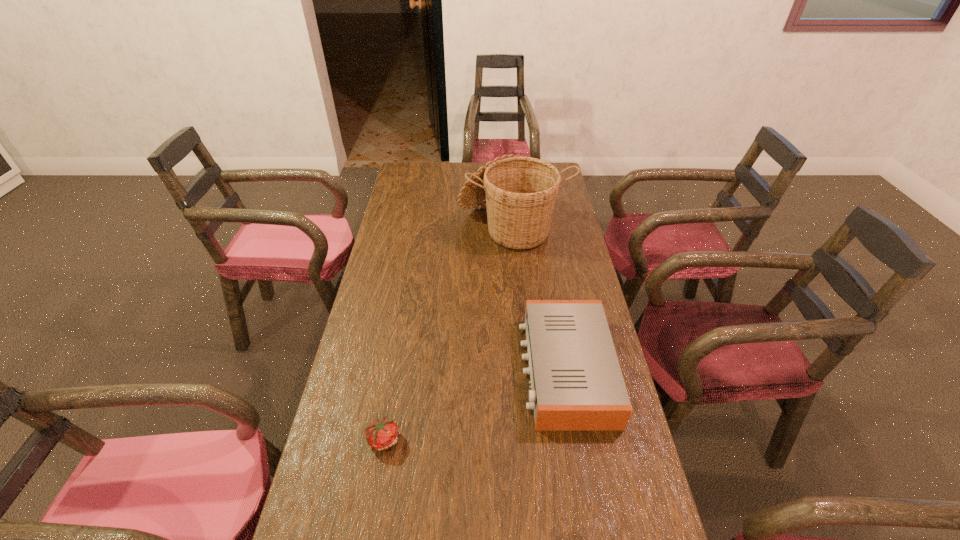
I want to click on free spot between the radio receiver and the shortest object, so click(474, 404).

Where is `free space between the shortest object and the radio receiver`? The height and width of the screenshot is (540, 960). free space between the shortest object and the radio receiver is located at coordinates (474, 404).

Locate which object ranks in proximity to the second tallest object. Please provide its 2D coordinates. Your answer should be formatted as a tuple, i.e. [(x, y)], where the tuple contains the x and y coordinates of a point satisfying the conditions above.

[(381, 434)]

I want to click on object that can be found as the closest to the leftmost object, so click(x=576, y=381).